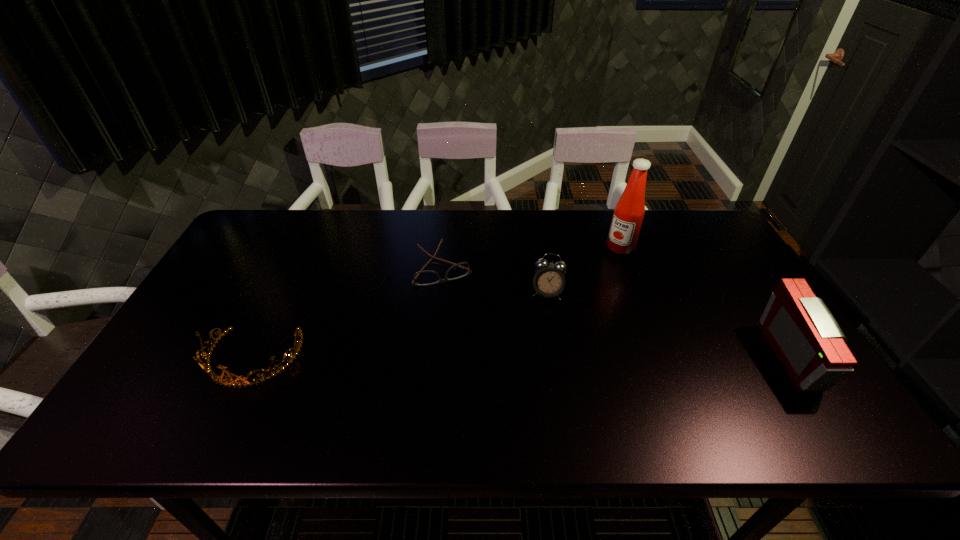
Locate an element on the screen. vacant area at the far left corner of the desktop is located at coordinates (260, 216).

The image size is (960, 540). In the image, there is a desktop. Identify the location of vacant space at the near right corner. (825, 396).

Find the location of a particular element. This screenshot has width=960, height=540. free point between the alarm clock and the camera is located at coordinates (671, 325).

The width and height of the screenshot is (960, 540). What are the coordinates of `free area in between the shortest object and the third shortest object` in the screenshot? It's located at (495, 280).

Find the location of `free space between the shortest object and the camera`. free space between the shortest object and the camera is located at coordinates (619, 313).

You are a GUI agent. You are given a task and a screenshot of the screen. Output one action in this format:
    pyautogui.click(x=<x>, y=<y>)
    Task: Click on the unoccupied area between the leftmost object and the fourth object from right to left
    This screenshot has width=960, height=540.
    Given the screenshot: What is the action you would take?
    pyautogui.click(x=348, y=313)

Identify the location of free space between the rightmost object and the fourth object from left to right. (707, 302).

At what (x,y) coordinates should I click in order to perform the action: click on free spot between the third shortest object and the fourth tallest object. Please return your answer as a coordinate pair (x, y). Looking at the image, I should click on (399, 326).

Identify the location of free space between the second object from left to right and the fourth shortest object. The image size is (960, 540). (619, 313).

Find the location of a particular element. The image size is (960, 540). free space between the condiment and the alarm clock is located at coordinates (584, 270).